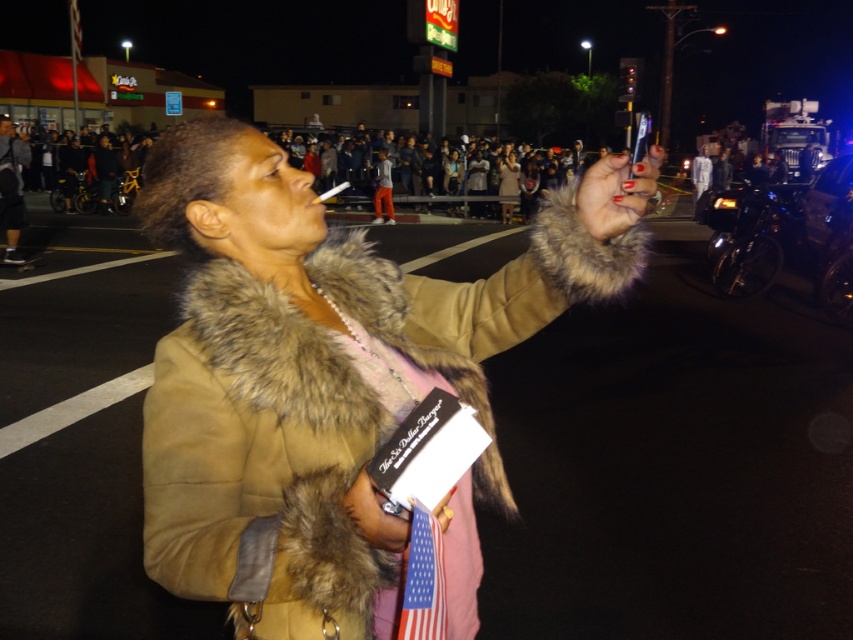
Question: Considering the relative positions of fur coat at center and white cotton shirt at upper center in the image provided, where is fur coat at center located with respect to white cotton shirt at upper center?

Choices:
 (A) left
 (B) right

Answer: (A)

Question: Among these objects, which one is nearest to the camera?

Choices:
 (A) fur coat at center
 (B) orange pants at center
 (C) tan suede coat at center

Answer: (C)

Question: Which point is closer to the camera?

Choices:
 (A) (509, 152)
 (B) (387, 224)

Answer: (B)

Question: Considering the real-world distances, which object is farthest from the denim jacket at left?

Choices:
 (A) fur coat at center
 (B) white cotton shirt at upper center
 (C) tan suede coat at center

Answer: (B)

Question: Does tan suede coat at center have a greater width compared to orange pants at center?

Choices:
 (A) yes
 (B) no

Answer: (A)

Question: Does tan suede coat at center appear under orange pants at center?

Choices:
 (A) no
 (B) yes

Answer: (B)